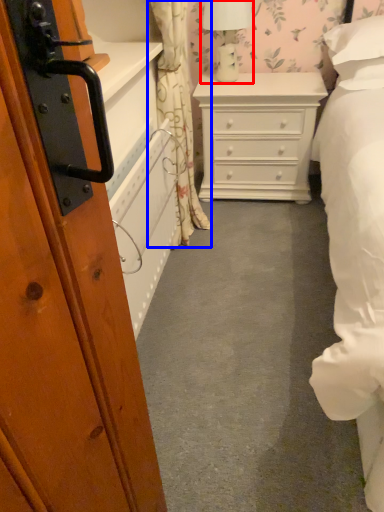
Question: Which point is further to the camera, table lamp (highlighted by a red box) or curtain (highlighted by a blue box)?

Choices:
 (A) table lamp
 (B) curtain

Answer: (A)